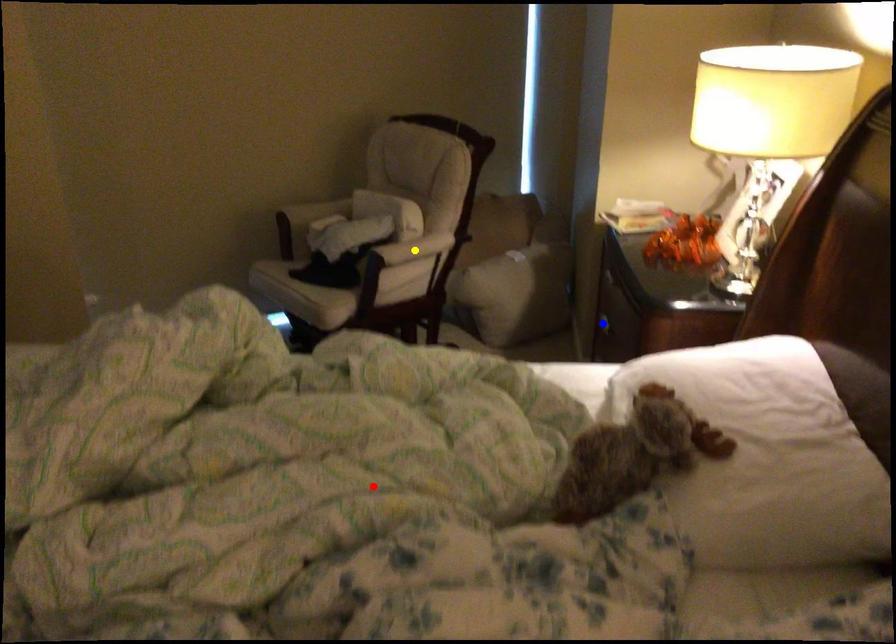
Order these from nearest to farthest:
A) red point
B) yellow point
C) blue point

red point
blue point
yellow point